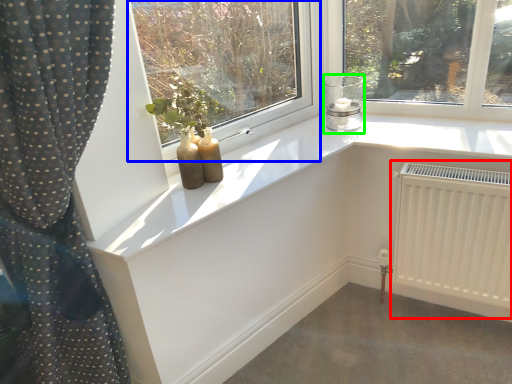
Question: Which object is the closest to the radiator (highlighted by a red box)? Choose among these: window (highlighted by a blue box) or candle holder (highlighted by a green box).

Choices:
 (A) window
 (B) candle holder

Answer: (B)